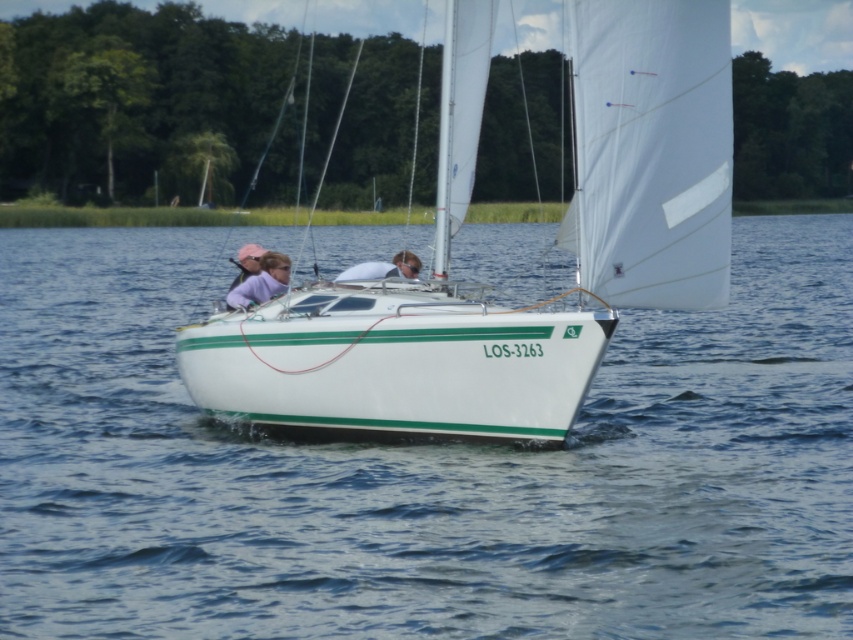
What do you see at coordinates (426, 472) in the screenshot? This screenshot has width=853, height=640. I see `clear blue water at center` at bounding box center [426, 472].

Which is more to the right, clear blue water at center or matte white shirt at center?

clear blue water at center

Is point (670, 458) positioned in front of point (421, 266)?

Yes, point (670, 458) is in front of point (421, 266).

Where is `clear blue water at center`? clear blue water at center is located at coordinates (426, 472).

Is point (447, 90) positioned behind point (283, 268)?

No, it is in front of (283, 268).

Is white glossy sailboat at center closer to the viewer compared to matte purple shirt at center?

Yes.

Find the location of a particular element. The image size is (853, 640). white glossy sailboat at center is located at coordinates (556, 236).

Can you confirm if matte purple shirt at center is positioned to the right of matte white shirt at center?

Incorrect, matte purple shirt at center is not on the right side of matte white shirt at center.

From the picture: How distant is matte purple shirt at center from matte white shirt at center?

A distance of 38.69 inches exists between matte purple shirt at center and matte white shirt at center.

Which is behind, point (283, 273) or point (415, 253)?

The point (415, 253) is more distant.

Image resolution: width=853 pixels, height=640 pixels. Identify the location of matte purple shirt at center. (260, 282).